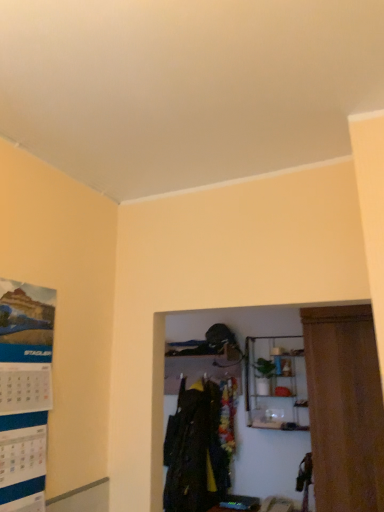
Question: Does matte paper poster at left contain metallic wire shelf at upper center?

Choices:
 (A) no
 (B) yes

Answer: (A)

Question: Can you confirm if matte paper poster at left is positioned to the left of metallic wire shelf at upper center?

Choices:
 (A) no
 (B) yes

Answer: (B)

Question: Considering the relative sizes of matte paper poster at left and metallic wire shelf at upper center in the image provided, is matte paper poster at left thinner than metallic wire shelf at upper center?

Choices:
 (A) yes
 (B) no

Answer: (A)

Question: Does matte paper poster at left have a smaller size compared to metallic wire shelf at upper center?

Choices:
 (A) no
 (B) yes

Answer: (B)

Question: Considering the relative sizes of matte paper poster at left and metallic wire shelf at upper center in the image provided, is matte paper poster at left shorter than metallic wire shelf at upper center?

Choices:
 (A) no
 (B) yes

Answer: (A)

Question: Is matte paper poster at left bigger than metallic wire shelf at upper center?

Choices:
 (A) no
 (B) yes

Answer: (A)

Question: Does metallic wire shelf at upper center appear on the left side of dark green fabric coat at center?

Choices:
 (A) yes
 (B) no

Answer: (B)

Question: Does metallic wire shelf at upper center lie behind dark green fabric coat at center?

Choices:
 (A) no
 (B) yes

Answer: (A)

Question: From a real-world perspective, is metallic wire shelf at upper center located beneath dark green fabric coat at center?

Choices:
 (A) yes
 (B) no

Answer: (B)

Question: Considering the relative sizes of metallic wire shelf at upper center and dark green fabric coat at center in the image provided, is metallic wire shelf at upper center thinner than dark green fabric coat at center?

Choices:
 (A) no
 (B) yes

Answer: (A)

Question: Does metallic wire shelf at upper center have a smaller size compared to dark green fabric coat at center?

Choices:
 (A) no
 (B) yes

Answer: (B)

Question: Does metallic wire shelf at upper center have a lesser height compared to dark green fabric coat at center?

Choices:
 (A) yes
 (B) no

Answer: (A)

Question: Is metallic wire shelf at upper center in contact with matte paper poster at left?

Choices:
 (A) no
 (B) yes

Answer: (A)